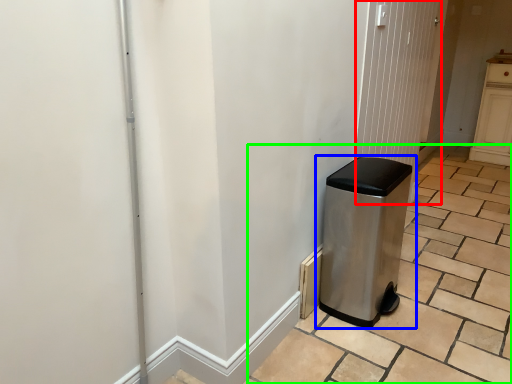
Question: Which object is the farthest from screen door (highlighted by a red box)? Choose among these: waste container (highlighted by a blue box) or tile (highlighted by a green box).

Choices:
 (A) waste container
 (B) tile

Answer: (B)